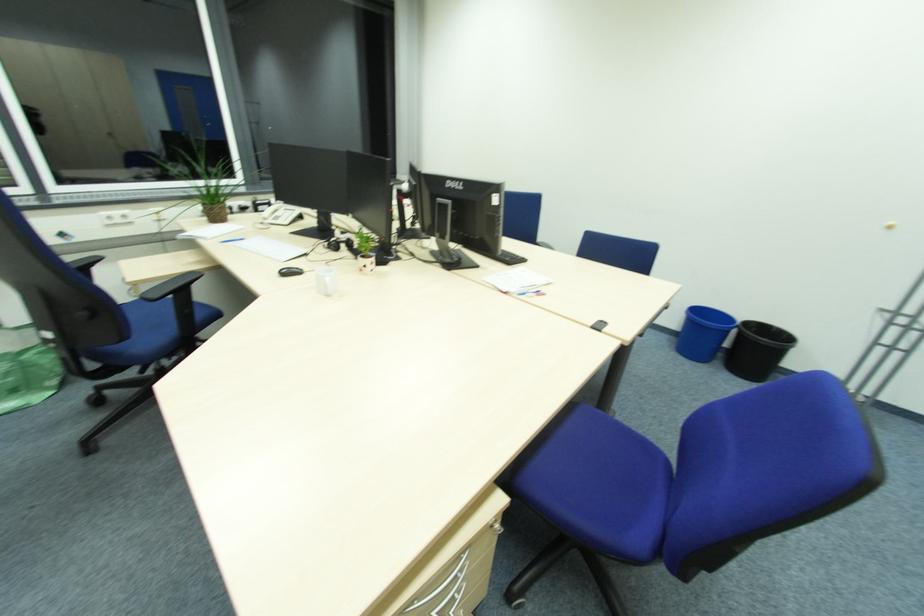
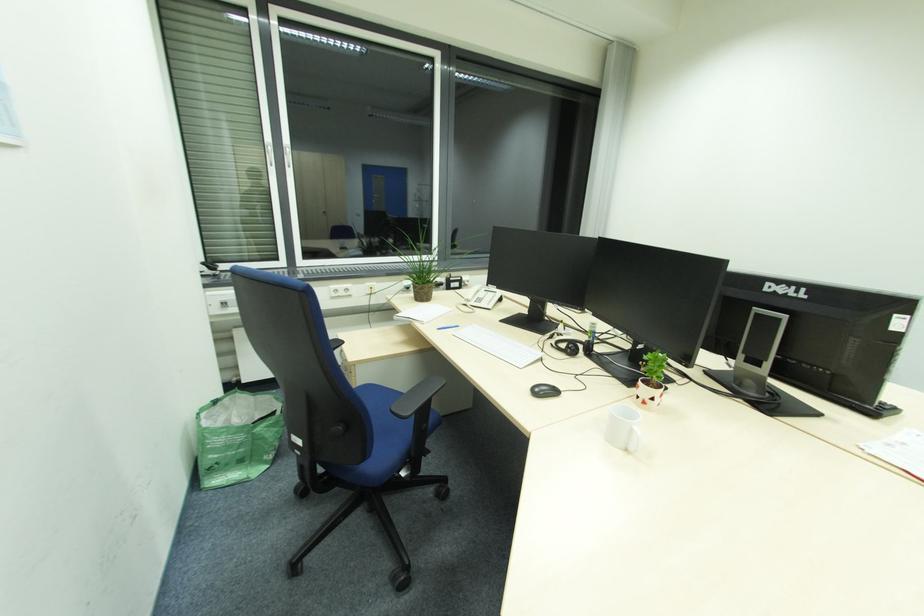
Question: The camera is either moving clockwise (left) or counter-clockwise (right) around the object. The first image is from the beginning of the video and the second image is from the end. Is the camera moving left or right when shooting the video?

Choices:
 (A) Left
 (B) Right

Answer: (B)